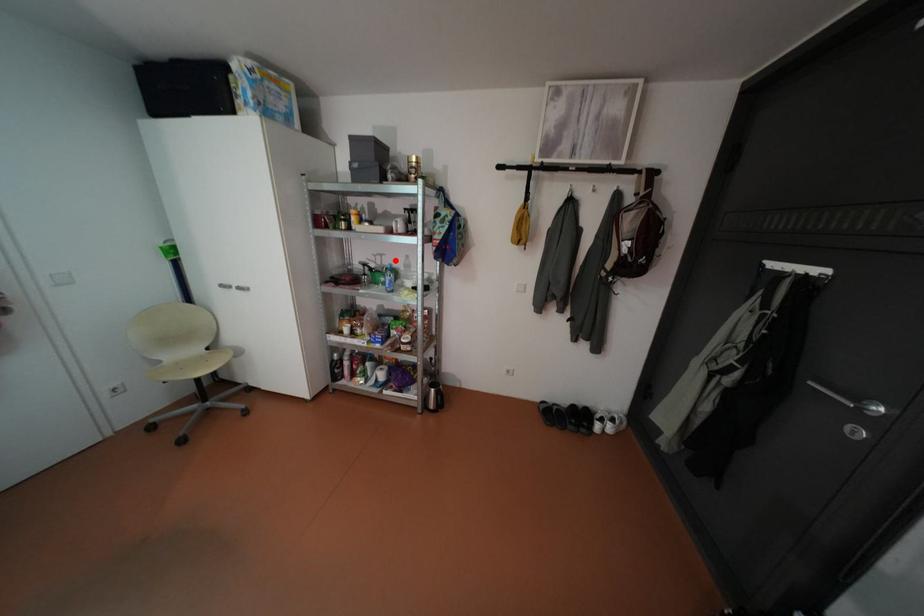
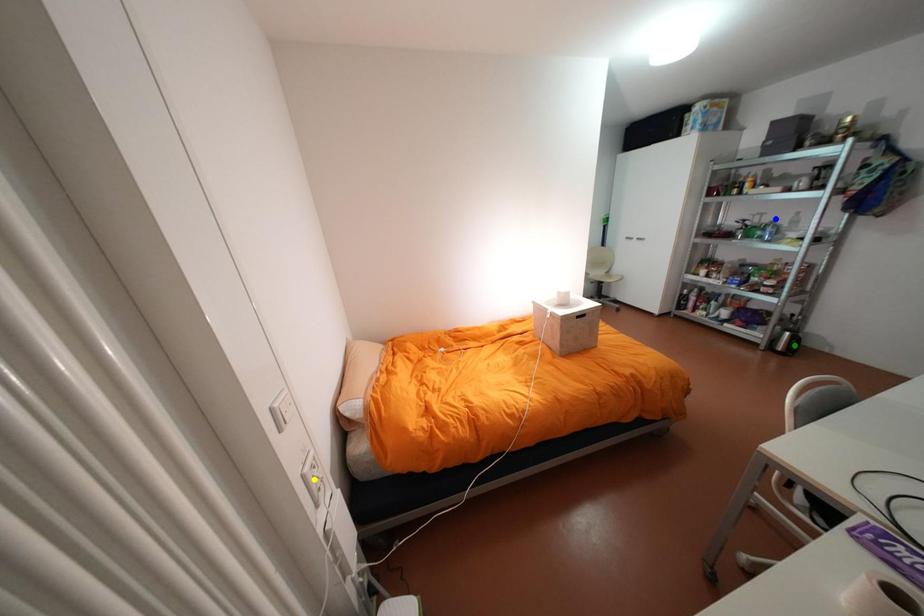
Question: I am providing you with two images of the same scene from different viewpoints. A red point is marked on the first image. You are given multiple points on the second image. Which mark in image 2 goes with the point in image 1?

Choices:
 (A) blue point
 (B) green point
 (C) yellow point

Answer: (A)